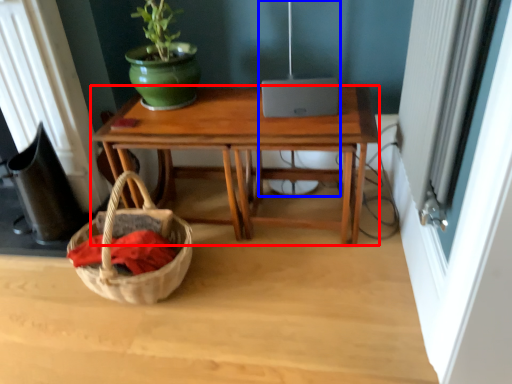
Question: Which point is closer to the camera, desk (highlighted by a red box) or lamp (highlighted by a blue box)?

Choices:
 (A) desk
 (B) lamp

Answer: (A)